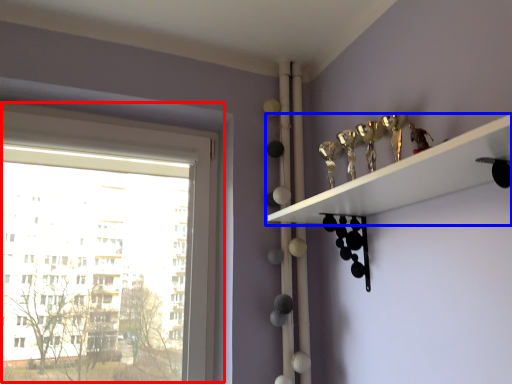
Question: Which object appears farthest to the camera in this image, window (highlighted by a red box) or shelf (highlighted by a blue box)?

Choices:
 (A) window
 (B) shelf

Answer: (A)